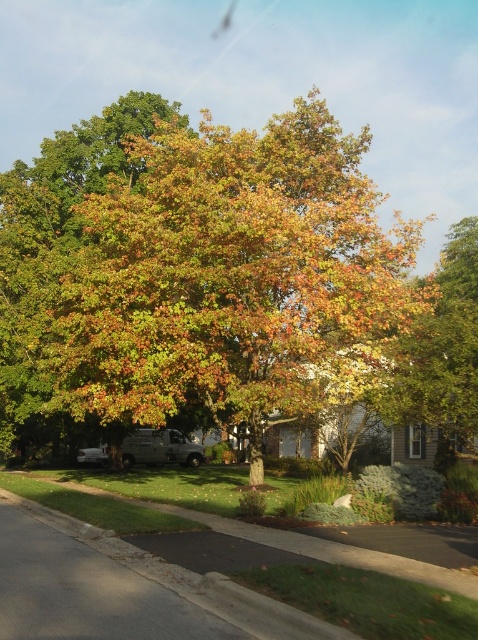
Which is behind, point (293, 317) or point (25, 241)?

Point (25, 241)

Between point (76, 358) and point (130, 124), which one is positioned in front?

Point (76, 358) is more forward.

The width and height of the screenshot is (478, 640). Describe the element at coordinates (229, 275) in the screenshot. I see `multicolored foliage at center` at that location.

Find the location of a particular element. multicolored foliage at center is located at coordinates (229, 275).